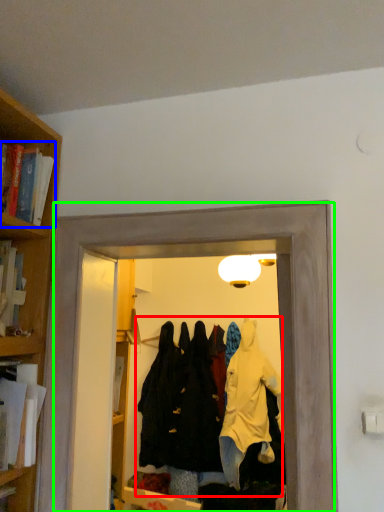
Question: Considering the real-world distances, which object is closest to clothing (highlighted by a red box)? book (highlighted by a blue box) or glass door (highlighted by a green box).

Choices:
 (A) book
 (B) glass door

Answer: (B)